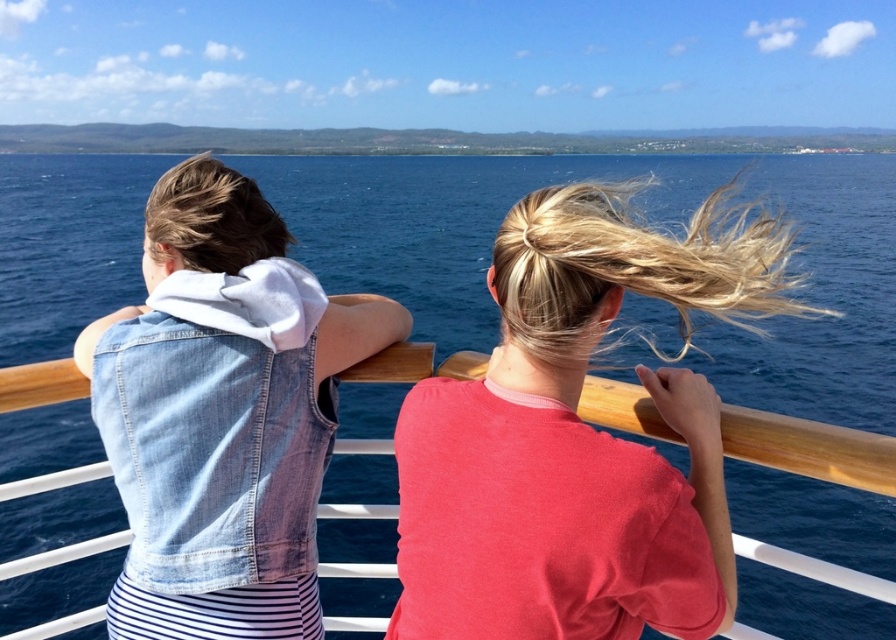
You are a photographer on the ship deck and want to capture both the denim vest at left and the blonde silky hair at upper left in a single frame. Based on their positions, which object should you adjust your camera focus to ensure both are in the same focal plane?

The denim vest at left is positioned under the blonde silky hair at upper left, so adjusting the focus to the denim vest at left will ensure both are in the same focal plane since it is closer to the camera.